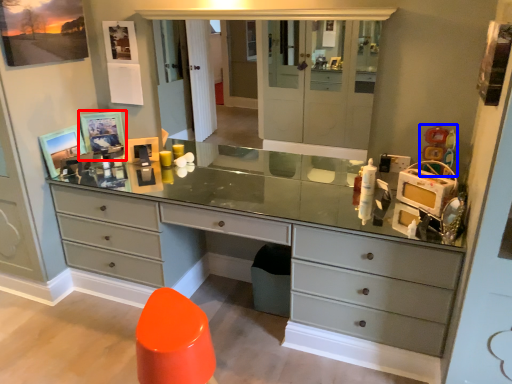
Question: Which object appears closest to the camera in this image, picture frame (highlighted by a red box) or toy (highlighted by a blue box)?

Choices:
 (A) picture frame
 (B) toy

Answer: (B)